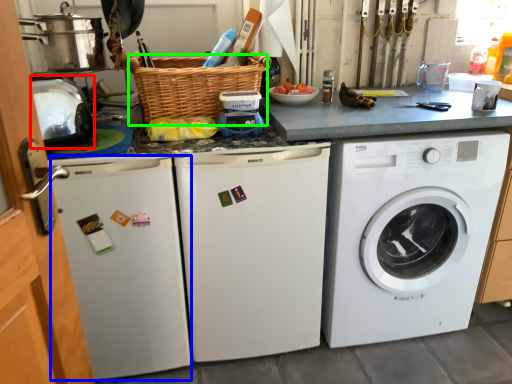
Question: Based on their relative distances, which object is nearer to appliance (highlighted by a red box)? Choose from dish washer (highlighted by a blue box) and basket (highlighted by a green box).

Choices:
 (A) dish washer
 (B) basket

Answer: (B)